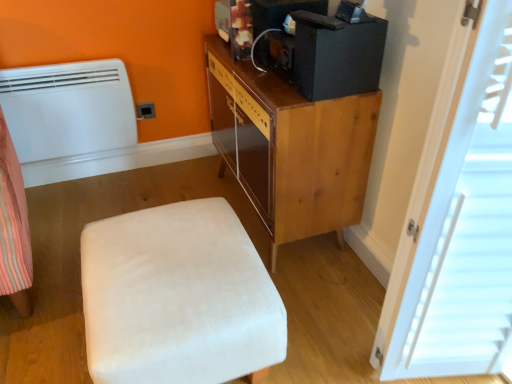
I want to click on wooden cabinet at upper right, so click(291, 148).

This screenshot has width=512, height=384. What do you see at coordinates (464, 232) in the screenshot?
I see `white wood door at right` at bounding box center [464, 232].

What do you see at coordinates (278, 29) in the screenshot?
I see `black matte speaker at upper center` at bounding box center [278, 29].

Find the location of a particular element. Image resolution: width=512 pixels, height=384 pixels. black matte desktop computer at upper right is located at coordinates (327, 52).

From a real-world perspective, is black matte speaker at upper center positioned over black matte desktop computer at upper right based on gravity?

No.

Between black matte speaker at upper center and black matte desktop computer at upper right, which one has larger size?

black matte desktop computer at upper right is bigger.

The height and width of the screenshot is (384, 512). In the image, there is a black matte speaker at upper center. In order to click on desktop computer below it (from the image's perspective) in this screenshot , I will do `click(327, 52)`.

Does black matte speaker at upper center appear on the left side of black matte desktop computer at upper right?

Indeed, black matte speaker at upper center is positioned on the left side of black matte desktop computer at upper right.

Is white wood door at right further to the viewer compared to wooden cabinet at upper right?

No.

Can wooden cabinet at upper right be found inside white wood door at right?

No.

Is white wood door at right positioned with its back to wooden cabinet at upper right?

Result: white wood door at right is not turned away from wooden cabinet at upper right.

From the image's perspective, which is above, white wood door at right or wooden cabinet at upper right?

wooden cabinet at upper right appears higher in the image.

Which object is more forward, white matte heater at left or white wood door at right?

white wood door at right is in front.

In the scene shown: Who is smaller, white matte heater at left or white wood door at right?

white matte heater at left.

From a real-world perspective, is white matte heater at left physically below white velvety ottoman at lower left?

No.

Which of these two, white matte heater at left or white velvety ottoman at lower left, stands taller?

white matte heater at left.

Measure the distance from white matte heater at left to white velvety ottoman at lower left.

white matte heater at left and white velvety ottoman at lower left are 1.03 meters apart.

In the scene shown: Is white matte heater at left aimed at white velvety ottoman at lower left?

Yes, white matte heater at left is aimed at white velvety ottoman at lower left.

Is matte plastic outlet at lower left shorter than wooden cabinet at upper right?

Yes, matte plastic outlet at lower left is shorter than wooden cabinet at upper right.

Is matte plastic outlet at lower left wider or thinner than wooden cabinet at upper right?

In the image, matte plastic outlet at lower left appears to be more narrow than wooden cabinet at upper right.

Between matte plastic outlet at lower left and wooden cabinet at upper right, which one appears on the right side from the viewer's perspective?

From the viewer's perspective, wooden cabinet at upper right appears more on the right side.

Based on the photo, could you tell me if matte plastic outlet at lower left is turned towards wooden cabinet at upper right?

No, matte plastic outlet at lower left is not turned towards wooden cabinet at upper right.

Is white matte heater at left beside matte plastic outlet at lower left?

No, white matte heater at left is not with matte plastic outlet at lower left.

In order to click on heater below the matte plastic outlet at lower left (from the image's perspective) in this screenshot , I will do `click(68, 118)`.

Does white matte heater at left appear on the left side of matte plastic outlet at lower left?

Yes.

Considering the relative sizes of white matte heater at left and matte plastic outlet at lower left in the image provided, is white matte heater at left bigger than matte plastic outlet at lower left?

Yes.

Who is more distant, black matte desktop computer at upper right or wooden cabinet at upper right?

wooden cabinet at upper right is further from the camera.

Considering the positions of objects black matte desktop computer at upper right and wooden cabinet at upper right in the image provided, who is more to the left, black matte desktop computer at upper right or wooden cabinet at upper right?

wooden cabinet at upper right is more to the left.

How different are the orientations of black matte desktop computer at upper right and wooden cabinet at upper right in degrees?

The angle between the facing direction of black matte desktop computer at upper right and the facing direction of wooden cabinet at upper right is 1.8 degrees.

Which of these two, black matte desktop computer at upper right or wooden cabinet at upper right, is wider?

wooden cabinet at upper right.

Image resolution: width=512 pixels, height=384 pixels. In the image, there is a black matte desktop computer at upper right. In order to click on appliance above it (from the image's perspective) in this screenshot , I will do `click(278, 29)`.

Locate an element on the screen. This screenshot has height=384, width=512. door on the right of the wooden cabinet at upper right is located at coordinates (464, 232).

Looking at the image, which one is located closer to wooden cabinet at upper right, white matte heater at left or white wood door at right?

The object closer to wooden cabinet at upper right is white wood door at right.

Based on their spatial positions, is white velvety ottoman at lower left or white wood door at right further from wooden cabinet at upper right?

white wood door at right.

Based on their spatial positions, is black matte desktop computer at upper right or white matte heater at left further from matte plastic outlet at lower left?

Among the two, black matte desktop computer at upper right is located further to matte plastic outlet at lower left.

Based on their spatial positions, is black matte speaker at upper center or white matte heater at left closer to wooden cabinet at upper right?

black matte speaker at upper center lies closer to wooden cabinet at upper right than the other object.

Estimate the real-world distances between objects in this image. Which object is further from white velvety ottoman at lower left, black matte desktop computer at upper right or black matte speaker at upper center?

black matte speaker at upper center.

Which object lies nearer to the anchor point white wood door at right, wooden cabinet at upper right or white velvety ottoman at lower left?

Based on the image, white velvety ottoman at lower left appears to be nearer to white wood door at right.

Estimate the real-world distances between objects in this image. Which object is closer to white wood door at right, black matte speaker at upper center or white matte heater at left?

black matte speaker at upper center.

Based on their spatial positions, is white velvety ottoman at lower left or wooden cabinet at upper right closer to matte plastic outlet at lower left?

Among the two, wooden cabinet at upper right is located nearer to matte plastic outlet at lower left.

This screenshot has height=384, width=512. I want to click on desktop computer situated between white matte heater at left and white wood door at right from left to right, so click(327, 52).

This screenshot has width=512, height=384. I want to click on appliance located between black matte desktop computer at upper right and matte plastic outlet at lower left in the depth direction, so click(x=278, y=29).

This screenshot has width=512, height=384. I want to click on desktop computer between black matte speaker at upper center and wooden cabinet at upper right in the up-down direction, so click(327, 52).

What are the coordinates of `appliance between white matte heater at left and black matte desktop computer at upper right from left to right` in the screenshot? It's located at (278, 29).